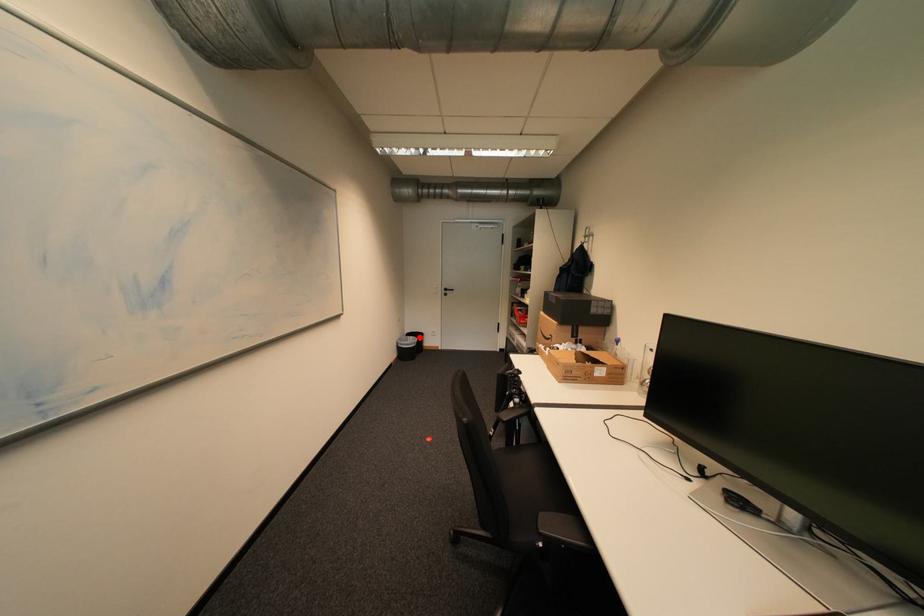
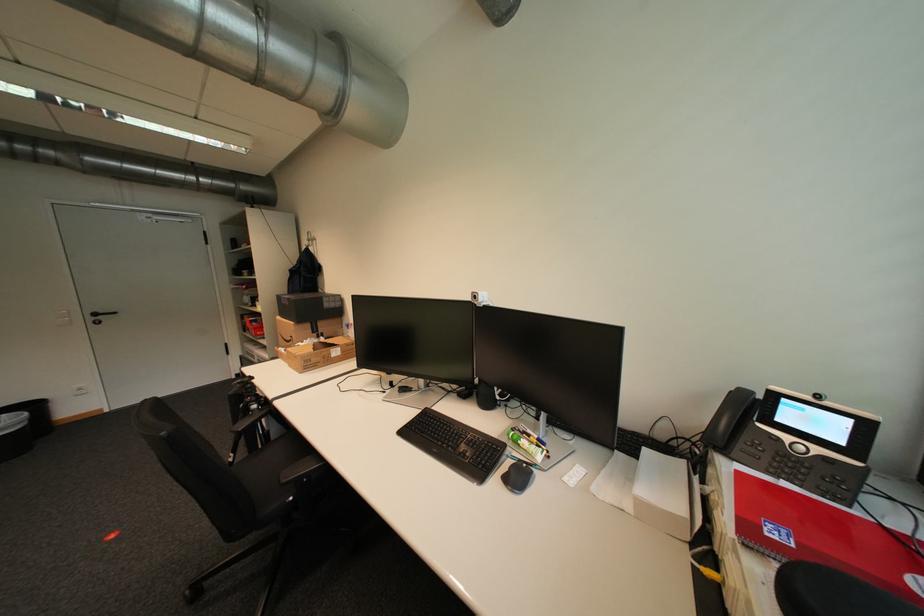
In the second image, find the point that corresponds to the highlighted location in the first image.

(11, 416)